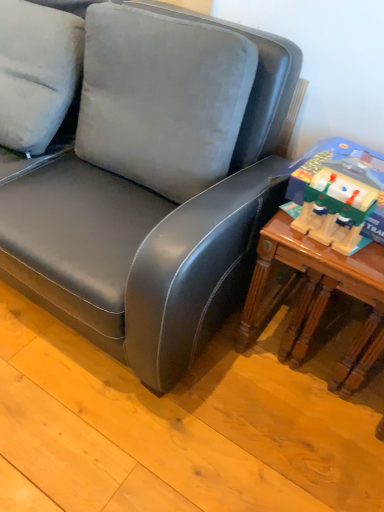
Question: Can you confirm if wooden table at right is thinner than wooden train set at right?

Choices:
 (A) yes
 (B) no

Answer: (B)

Question: Is wooden train set at right at the back of wooden table at right?

Choices:
 (A) no
 (B) yes

Answer: (A)

Question: Does wooden table at right have a larger size compared to wooden train set at right?

Choices:
 (A) yes
 (B) no

Answer: (A)

Question: From a real-world perspective, does wooden table at right stand above wooden train set at right?

Choices:
 (A) no
 (B) yes

Answer: (A)

Question: From a real-world perspective, is wooden table at right physically below wooden train set at right?

Choices:
 (A) yes
 (B) no

Answer: (A)

Question: From the image's perspective, is wooden table at right under wooden train set at right?

Choices:
 (A) yes
 (B) no

Answer: (A)

Question: From the image's perspective, is wooden train set at right above wooden table at right?

Choices:
 (A) yes
 (B) no

Answer: (A)

Question: Is wooden train set at right to the left of wooden table at right from the viewer's perspective?

Choices:
 (A) yes
 (B) no

Answer: (A)

Question: Is wooden train set at right to the right of wooden table at right from the viewer's perspective?

Choices:
 (A) yes
 (B) no

Answer: (B)

Question: Is wooden train set at right thinner than wooden table at right?

Choices:
 (A) yes
 (B) no

Answer: (A)

Question: Does wooden train set at right come behind wooden table at right?

Choices:
 (A) yes
 (B) no

Answer: (B)

Question: Is wooden train set at right oriented towards wooden table at right?

Choices:
 (A) yes
 (B) no

Answer: (B)

Question: From the image's perspective, is wooden train set at right above or below wooden table at right?

Choices:
 (A) above
 (B) below

Answer: (A)